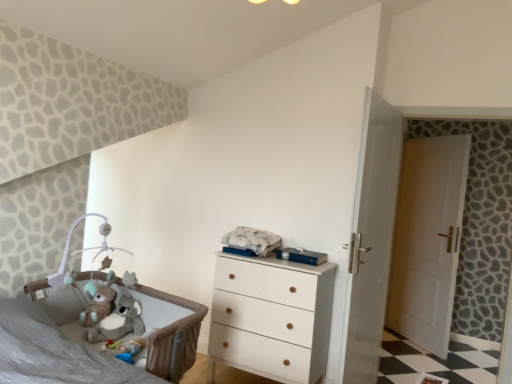
Question: Is the depth of soft gray fabric infant bed at lower left less than that of white wooden door at right?

Choices:
 (A) no
 (B) yes

Answer: (B)

Question: Considering the relative sizes of soft gray fabric infant bed at lower left and white wooden door at right in the image provided, is soft gray fabric infant bed at lower left taller than white wooden door at right?

Choices:
 (A) no
 (B) yes

Answer: (A)

Question: Is soft gray fabric infant bed at lower left further to camera compared to white wooden door at right?

Choices:
 (A) yes
 (B) no

Answer: (B)

Question: Does soft gray fabric infant bed at lower left have a greater width compared to white wooden door at right?

Choices:
 (A) no
 (B) yes

Answer: (B)

Question: Can white wooden door at right be found inside soft gray fabric infant bed at lower left?

Choices:
 (A) no
 (B) yes

Answer: (A)

Question: Is point (253, 278) positioned closer to the camera than point (390, 301)?

Choices:
 (A) farther
 (B) closer

Answer: (B)

Question: Considering the positions of white wood chest of drawers at center and white wooden door at right in the image, is white wood chest of drawers at center wider or thinner than white wooden door at right?

Choices:
 (A) wide
 (B) thin

Answer: (A)

Question: Relative to white wooden door at right, is white wood chest of drawers at center in front or behind?

Choices:
 (A) front
 (B) behind

Answer: (A)

Question: From the image's perspective, is white wood chest of drawers at center positioned above or below white wooden door at right?

Choices:
 (A) below
 (B) above

Answer: (A)

Question: Is point (139, 322) positioned closer to the camera than point (167, 302)?

Choices:
 (A) closer
 (B) farther

Answer: (A)

Question: Considering their positions, is fluffy plush koala at lower left located in front of or behind soft gray fabric infant bed at lower left?

Choices:
 (A) front
 (B) behind

Answer: (B)

Question: From the image's perspective, is fluffy plush koala at lower left positioned above or below soft gray fabric infant bed at lower left?

Choices:
 (A) below
 (B) above

Answer: (B)

Question: Considering the positions of fluffy plush koala at lower left and soft gray fabric infant bed at lower left in the image, is fluffy plush koala at lower left bigger or smaller than soft gray fabric infant bed at lower left?

Choices:
 (A) small
 (B) big

Answer: (A)

Question: Is fluffy plush koala at lower left to the left or to the right of white wooden door at right in the image?

Choices:
 (A) right
 (B) left

Answer: (B)

Question: Considering the positions of point (128, 317) and point (437, 236), is point (128, 317) closer or farther from the camera than point (437, 236)?

Choices:
 (A) farther
 (B) closer

Answer: (B)